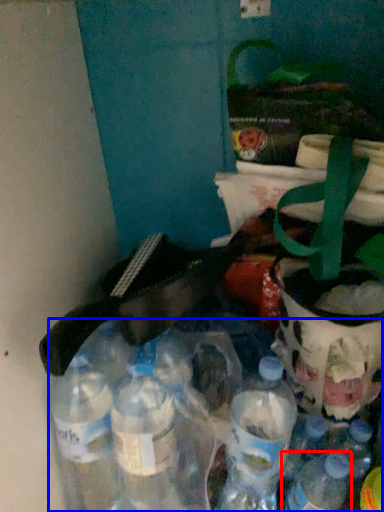
Question: Which object appears closest to the camera in this image, bottle (highlighted by a red box) or bottle (highlighted by a blue box)?

Choices:
 (A) bottle
 (B) bottle

Answer: (B)